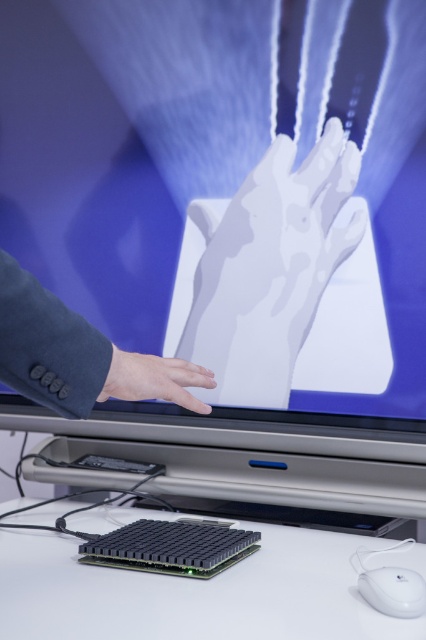
Question: Does white matte hand at center have a greater width compared to smooth skin hand at lower left?

Choices:
 (A) yes
 (B) no

Answer: (A)

Question: Does white matte hand at center appear on the right side of white plastic mouse at lower right?

Choices:
 (A) no
 (B) yes

Answer: (A)

Question: From the image, what is the correct spatial relationship of white matte hand at center in relation to white plastic mouse at lower right?

Choices:
 (A) left
 (B) right

Answer: (A)

Question: Which of these objects is positioned farthest from the smooth skin hand at lower left?

Choices:
 (A) white matte hand at center
 (B) white plastic mouse at lower right

Answer: (A)

Question: Which point appears closest to the camera in this image?

Choices:
 (A) pyautogui.click(x=408, y=612)
 (B) pyautogui.click(x=290, y=289)

Answer: (A)

Question: Which point appears closest to the camera in this image?

Choices:
 (A) (106, 396)
 (B) (394, 605)
 (C) (141, 620)

Answer: (A)